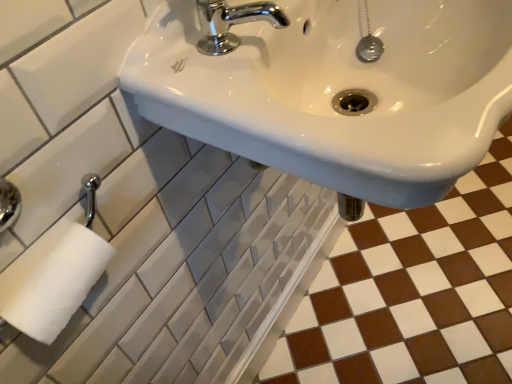
In order to click on free space below white glossy sink at upper center (from a real-world perspective) in this screenshot , I will do `click(351, 333)`.